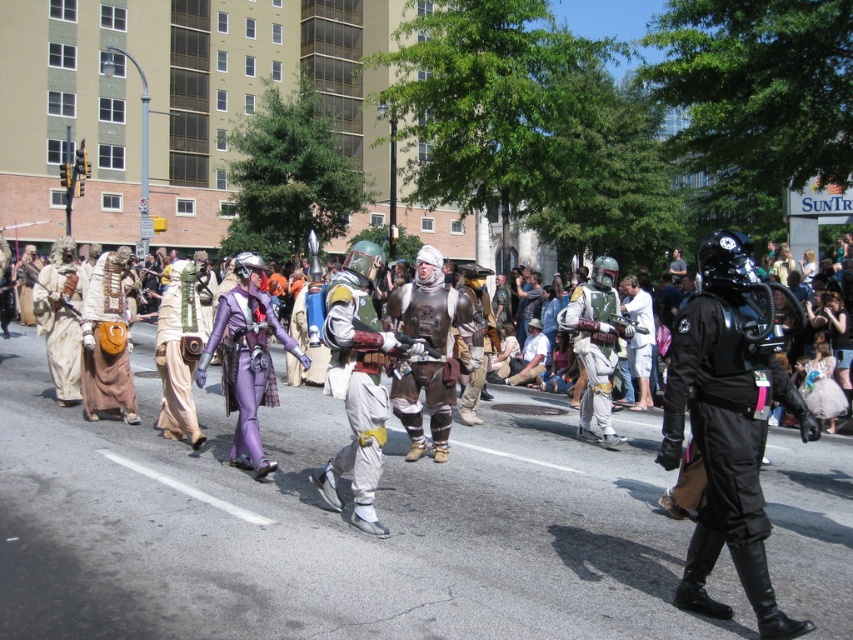
Question: Which object is the farthest from the black matte helmet at right?

Choices:
 (A) purple metallic costume at center
 (B) tan fabric bag at left
 (C) metallic armor at center

Answer: (B)

Question: Which point is farther to the camera?

Choices:
 (A) purple matte suit at center
 (B) black matte helmet at right
 (C) white matte helmet at center
 (D) leather-like brown bag at left

Answer: (D)

Question: Can you confirm if metallic armor at center is positioned below tan fabric bag at left?

Choices:
 (A) no
 (B) yes

Answer: (B)

Question: Is black matte helmet at right smaller than white matte helmet at center?

Choices:
 (A) yes
 (B) no

Answer: (B)

Question: Which object appears closest to the camera in this image?

Choices:
 (A) metallic armor at center
 (B) purple fabric/gauze at center
 (C) tan fabric bag at left
 (D) black matte helmet at right

Answer: (D)

Question: Does metallic armor at center appear on the left side of purple fabric/gauze at center?

Choices:
 (A) yes
 (B) no

Answer: (B)